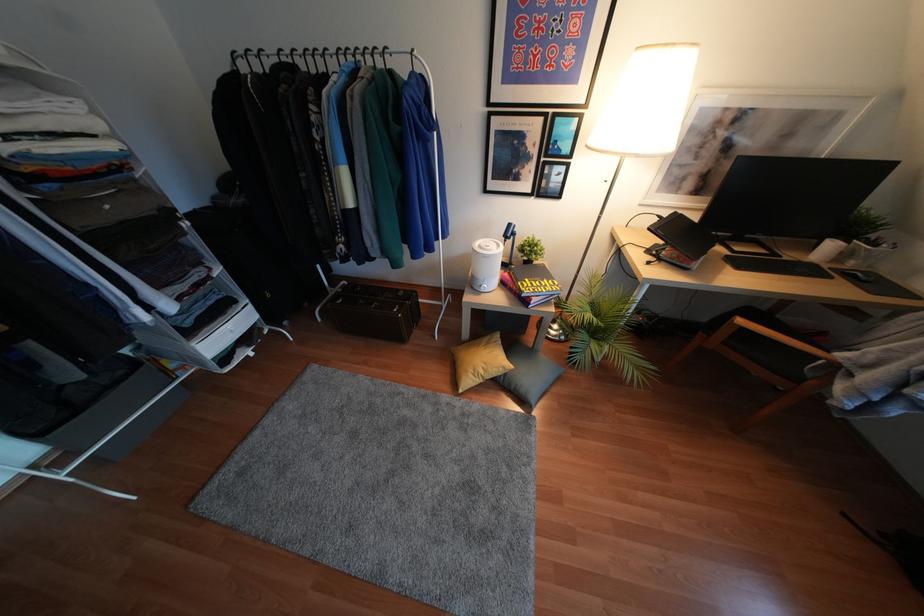
Where is `chair armrest`? The height and width of the screenshot is (616, 924). chair armrest is located at coordinates (756, 331).